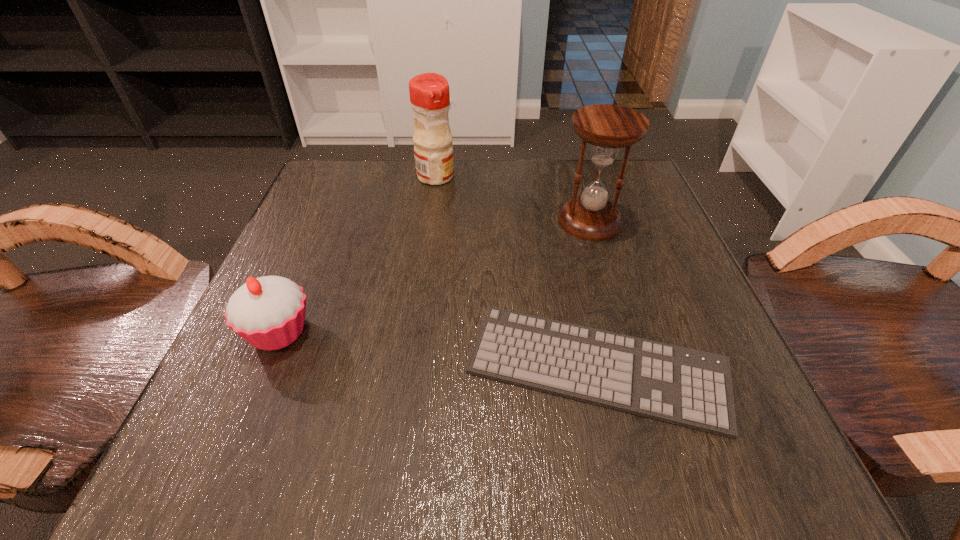
Locate an element on the screen. The image size is (960, 540). condiment present at the far edge is located at coordinates (429, 93).

Image resolution: width=960 pixels, height=540 pixels. I want to click on hourglass at the far edge, so click(607, 127).

Locate an element on the screen. Image resolution: width=960 pixels, height=540 pixels. object present at the near edge is located at coordinates (692, 388).

Where is `object located in the left edge section of the desktop`? object located in the left edge section of the desktop is located at coordinates (268, 312).

The image size is (960, 540). Find the location of `hourglass at the right edge`. hourglass at the right edge is located at coordinates (607, 127).

At what (x,y) coordinates should I click in order to perform the action: click on computer keyboard that is positioned at the right edge. Please return your answer as a coordinate pair (x, y). Looking at the image, I should click on (692, 388).

This screenshot has height=540, width=960. In order to click on object that is at the far right corner in this screenshot , I will do `click(607, 127)`.

You are a GUI agent. You are given a task and a screenshot of the screen. Output one action in this format:
    pyautogui.click(x=<x>, y=<y>)
    Task: Click on the object that is at the near right corner
    The image size is (960, 540).
    Given the screenshot: What is the action you would take?
    pyautogui.click(x=692, y=388)

Image resolution: width=960 pixels, height=540 pixels. I want to click on vacant region at the far edge of the desktop, so click(x=565, y=168).

Locate an element on the screen. The height and width of the screenshot is (540, 960). vacant region at the near edge of the desktop is located at coordinates (463, 425).